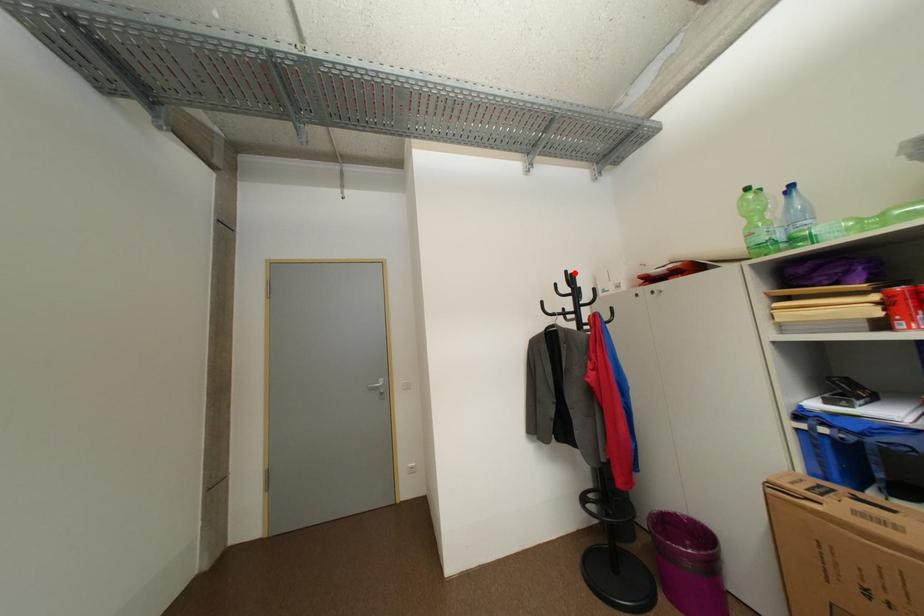
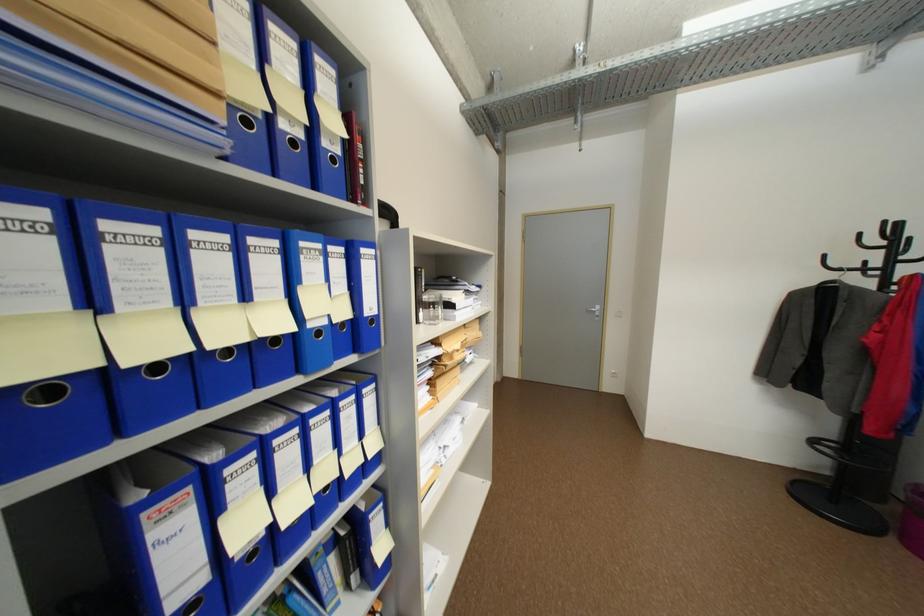
Where in the second image is the point corresponding to the highlighted location from the first image?

(893, 224)